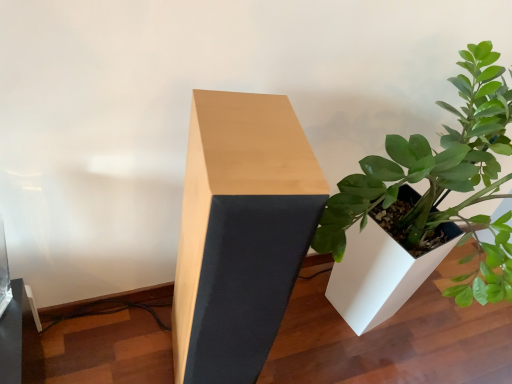
Describe the element at coordinates (240, 232) in the screenshot. This screenshot has height=384, width=512. I see `light wood/black fabric table at center` at that location.

Locate an element on the screen. light wood/black fabric table at center is located at coordinates (240, 232).

What is the approximate width of light wood/black fabric table at center?

light wood/black fabric table at center is 15.52 inches in width.

The height and width of the screenshot is (384, 512). What do you see at coordinates (424, 205) in the screenshot? I see `white matte planter at right` at bounding box center [424, 205].

This screenshot has height=384, width=512. Find the location of `white matte planter at right`. white matte planter at right is located at coordinates (424, 205).

The height and width of the screenshot is (384, 512). In order to click on light wood/black fabric table at center in this screenshot , I will do `click(240, 232)`.

Visually, is white matte planter at right positioned to the left or to the right of light wood/black fabric table at center?

Based on their positions, white matte planter at right is located to the right of light wood/black fabric table at center.

Between white matte planter at right and light wood/black fabric table at center, which one is positioned behind?

light wood/black fabric table at center.

Is point (347, 265) closer to viewer compared to point (294, 260)?

No, (347, 265) is behind (294, 260).

From the image's perspective, between white matte planter at right and light wood/black fabric table at center, which one is located above?

white matte planter at right is shown above in the image.

From a real-world perspective, does white matte planter at right stand above light wood/black fabric table at center?

Yes, from a real-world perspective, white matte planter at right is over light wood/black fabric table at center

Considering the sizes of objects white matte planter at right and light wood/black fabric table at center in the image provided, who is thinner, white matte planter at right or light wood/black fabric table at center?

Thinner between the two is light wood/black fabric table at center.

Is white matte planter at right taller than light wood/black fabric table at center?

Yes.

Is white matte planter at right smaller than light wood/black fabric table at center?

No, white matte planter at right is not smaller than light wood/black fabric table at center.

Is light wood/black fabric table at center inside white matte planter at right?

No, light wood/black fabric table at center is located outside of white matte planter at right.

Does white matte planter at right touch light wood/black fabric table at center?

No, white matte planter at right is not beside light wood/black fabric table at center.

Is white matte planter at right facing towards light wood/black fabric table at center?

No, white matte planter at right is not oriented towards light wood/black fabric table at center.

Identify the location of houseplant on the right of light wood/black fabric table at center. The width and height of the screenshot is (512, 384). 424,205.

Considering the relative positions of light wood/black fabric table at center and white matte planter at right in the image provided, is light wood/black fabric table at center to the left of white matte planter at right from the viewer's perspective?

Yes.

Is light wood/black fabric table at center positioned before white matte planter at right?

No, the depth of light wood/black fabric table at center is greater than that of white matte planter at right.

Does point (244, 160) come farther from viewer compared to point (421, 164)?

No, it is not.

From the image's perspective, is light wood/black fabric table at center under white matte planter at right?

Yes, from the image's perspective, light wood/black fabric table at center is beneath white matte planter at right.

From a real-world perspective, which is physically above, light wood/black fabric table at center or white matte planter at right?

white matte planter at right.

Does light wood/black fabric table at center have a greater width compared to white matte planter at right?

In fact, light wood/black fabric table at center might be narrower than white matte planter at right.

Who is shorter, light wood/black fabric table at center or white matte planter at right?

light wood/black fabric table at center is shorter.

Between light wood/black fabric table at center and white matte planter at right, which one has larger size?

With larger size is white matte planter at right.

Is light wood/black fabric table at center not within white matte planter at right?

light wood/black fabric table at center is positioned outside white matte planter at right.

Is light wood/black fabric table at center far away from white matte planter at right?

No, light wood/black fabric table at center is not far away from white matte planter at right.

Is light wood/black fabric table at center aimed at white matte planter at right?

No, light wood/black fabric table at center does not turn towards white matte planter at right.

Where is `houseplant located above the light wood/black fabric table at center (from a real-world perspective)`? The image size is (512, 384). houseplant located above the light wood/black fabric table at center (from a real-world perspective) is located at coordinates (424, 205).

You are a GUI agent. You are given a task and a screenshot of the screen. Output one action in this format:
    pyautogui.click(x=<x>, y=<y>)
    Task: Click on the houseplant on the right of light wood/black fabric table at center
    Image resolution: width=512 pixels, height=384 pixels.
    Given the screenshot: What is the action you would take?
    pyautogui.click(x=424, y=205)

Locate an element on the screen. The image size is (512, 384). houseplant above the light wood/black fabric table at center (from a real-world perspective) is located at coordinates (424, 205).